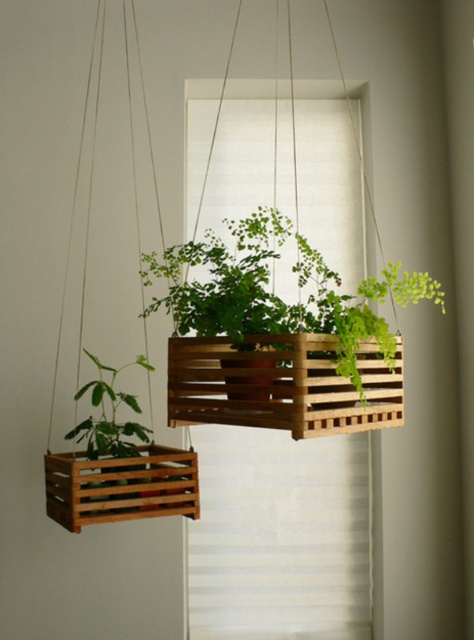
You are an interior designer planning to place a decorative item between the wooden slats at center and the brown wooden crate at left. Given their widths, which object should you position closer to the wall to ensure the decorative item fits snugly?

The wooden slats at center are wider than the brown wooden crate at left. To fit the decorative item snugly between them, position the narrower brown wooden crate at left closer to the wall so that the wider wooden slats at center can accommodate the space better.

You are arranging a new potted plant and need to place it between the wooden slats at center and the brown wooden crate at left. Which side should you place the new plant to ensure it is between them?

The wooden slats at center is to the right of the brown wooden crate at left, so placing the new plant between them would require positioning it to the right of the brown wooden crate at left and to the left of the wooden slats at center.